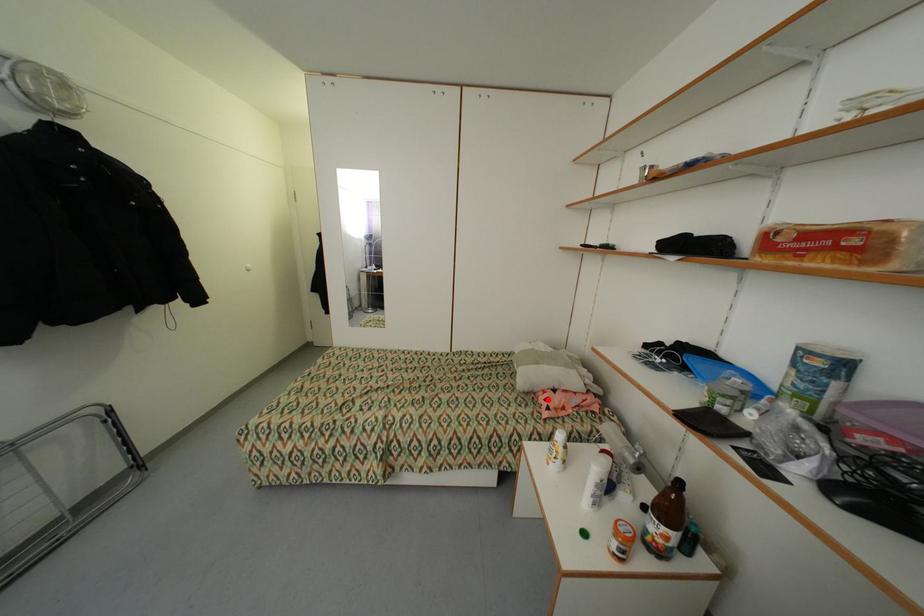
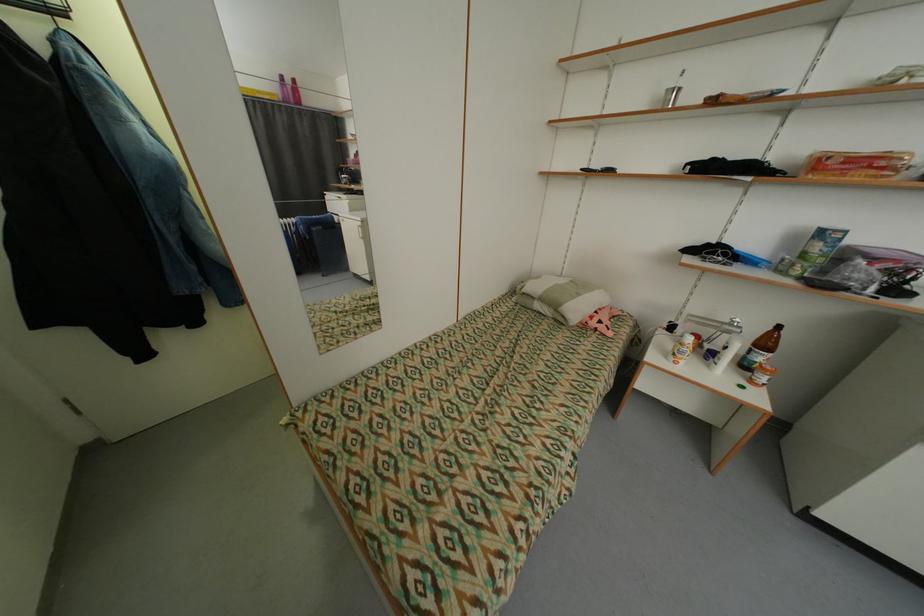
In the second image, find the point that corresponds to the highlighted location in the first image.

(600, 323)